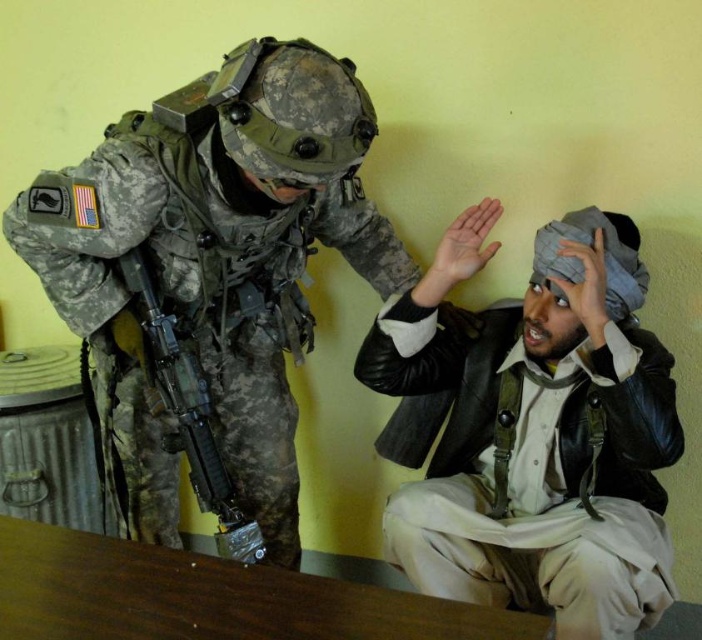
Question: Can you confirm if leather jacket at center is positioned above brown wooden table at lower left?

Choices:
 (A) no
 (B) yes

Answer: (B)

Question: Is camouflage fabric uniform at left positioned behind matte black rifle at left?

Choices:
 (A) no
 (B) yes

Answer: (A)

Question: Among these objects, which one is nearest to the camera?

Choices:
 (A) brown wooden table at lower left
 (B) camouflage fabric uniform at left
 (C) leather jacket at center

Answer: (A)

Question: Which point appears closest to the camera in this image?

Choices:
 (A) (244, 609)
 (B) (256, 320)
 (C) (437, 364)

Answer: (A)

Question: Does camouflage fabric uniform at left appear under matte black rifle at left?

Choices:
 (A) no
 (B) yes

Answer: (A)

Question: Considering the real-world distances, which object is closest to the leather jacket at center?

Choices:
 (A) camouflage fabric uniform at left
 (B) matte black rifle at left
 (C) brown wooden table at lower left

Answer: (A)